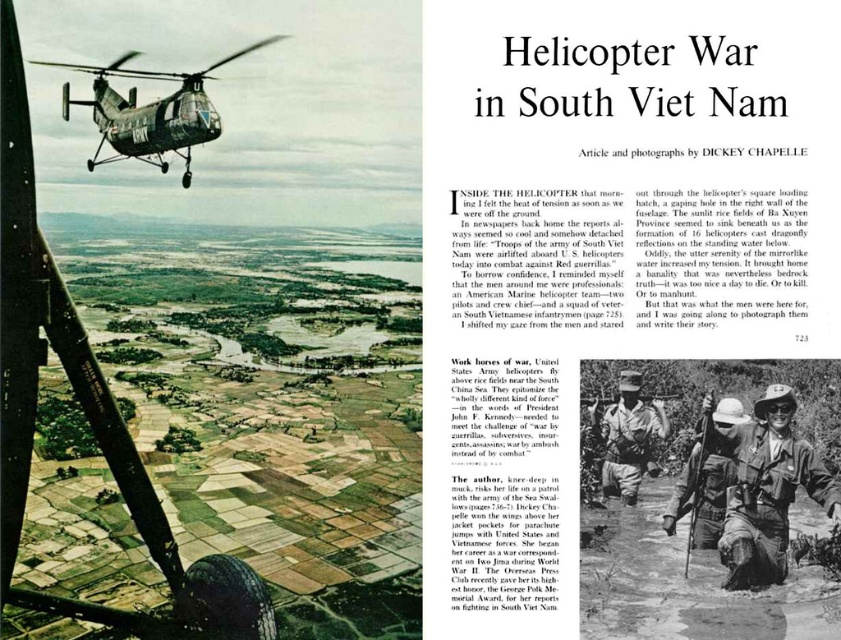
Question: In this image, where is camouflage fabric helmet at lower right located relative to camouflage fabric helmet at center?

Choices:
 (A) above
 (B) below

Answer: (A)

Question: Is green camouflage helicopter at upper left bigger than camouflage fabric uniform at center?

Choices:
 (A) no
 (B) yes

Answer: (B)

Question: Is green camouflage helicopter at upper left behind camouflage fabric helmet at center?

Choices:
 (A) no
 (B) yes

Answer: (B)

Question: Based on their relative distances, which object is nearer to the green camouflage helicopter at upper left?

Choices:
 (A) camouflage fabric helmet at lower right
 (B) camouflage fabric helmet at center
 (C) camouflage fabric uniform at center

Answer: (A)

Question: Estimate the real-world distances between objects in this image. Which object is farther from the green camouflage helicopter at upper left?

Choices:
 (A) camouflage fabric uniform at center
 (B) camouflage fabric helmet at center
 (C) camouflage fabric helmet at lower right

Answer: (A)

Question: Which object is positioned closest to the camouflage fabric helmet at lower right?

Choices:
 (A) camouflage fabric uniform at center
 (B) green camouflage helicopter at upper left
 (C) camouflage fabric helmet at center

Answer: (C)